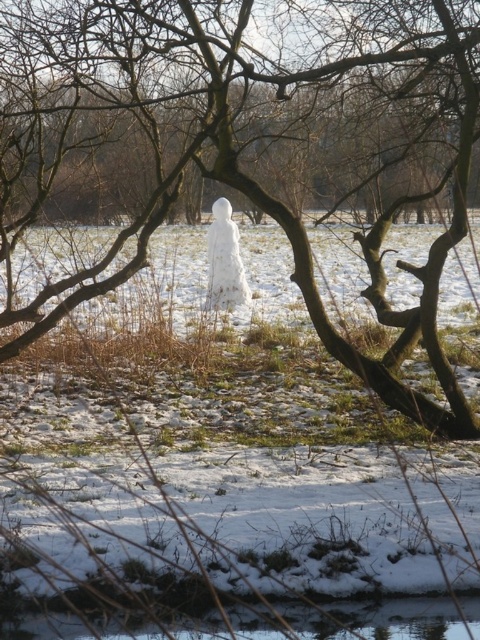
Is white snowman at center above white fluffy snowman at center?

Indeed, white snowman at center is positioned over white fluffy snowman at center.

Does white snowman at center have a lesser width compared to white fluffy snowman at center?

No.

Image resolution: width=480 pixels, height=640 pixels. I want to click on white snowman at center, so click(241, 134).

I want to click on white snowman at center, so click(x=241, y=134).